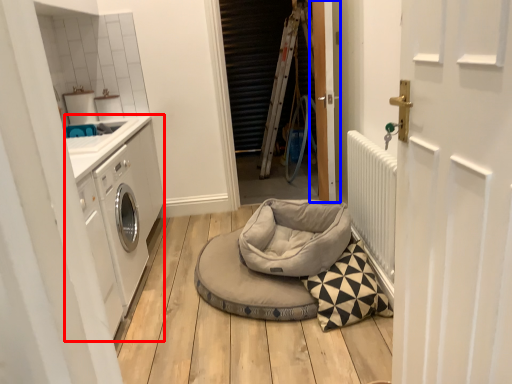
Question: Which point is further to the camera, washing machine (highlighted by a red box) or door (highlighted by a blue box)?

Choices:
 (A) washing machine
 (B) door

Answer: (A)